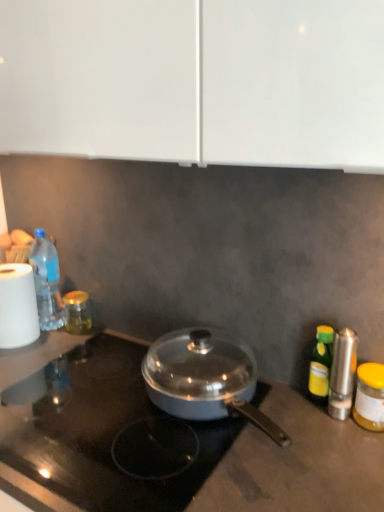
Question: Is green glass bottle at right, which is the 2th bottle in front-to-back order, bigger than white matte paper towel at left?

Choices:
 (A) yes
 (B) no

Answer: (B)

Question: Is green glass bottle at right, the 3th bottle positioned from the back, directly adjacent to white matte paper towel at left?

Choices:
 (A) no
 (B) yes

Answer: (A)

Question: Is green glass bottle at right, the third bottle from the left, positioned before white matte paper towel at left?

Choices:
 (A) no
 (B) yes

Answer: (B)

Question: From the image's perspective, is green glass bottle at right, marked as the second bottle in a right-to-left arrangement, under white matte paper towel at left?

Choices:
 (A) yes
 (B) no

Answer: (A)

Question: Is green glass bottle at right, the 3th bottle positioned from the back, outside white matte paper towel at left?

Choices:
 (A) yes
 (B) no

Answer: (A)

Question: From a real-world perspective, is white matte paper towel at left physically located above or below gold glass jar at left, which ranks as the 3th bottle in right-to-left order?

Choices:
 (A) below
 (B) above

Answer: (B)

Question: From the image's perspective, relative to gold glass jar at left, which ranks as the 3th bottle in right-to-left order, is white matte paper towel at left above or below?

Choices:
 (A) above
 (B) below

Answer: (A)

Question: Is point (14, 329) closer or farther from the camera than point (82, 301)?

Choices:
 (A) farther
 (B) closer

Answer: (B)

Question: Considering the positions of white matte paper towel at left and gold glass jar at left, the 4th bottle from the front, in the image, is white matte paper towel at left taller or shorter than gold glass jar at left, the 4th bottle from the front,?

Choices:
 (A) short
 (B) tall

Answer: (B)

Question: Which is correct: silver metallic salt shaker at right is inside gold glass jar at left, which ranks as the 3th bottle in right-to-left order, or outside of it?

Choices:
 (A) outside
 (B) inside

Answer: (A)

Question: In terms of size, does silver metallic salt shaker at right appear bigger or smaller than gold glass jar at left, which ranks as the second bottle in left-to-right order?

Choices:
 (A) small
 (B) big

Answer: (A)

Question: From the image's perspective, is silver metallic salt shaker at right positioned above or below gold glass jar at left, the 4th bottle from the front?

Choices:
 (A) below
 (B) above

Answer: (A)

Question: In the image, is silver metallic salt shaker at right positioned in front of or behind gold glass jar at left, the 4th bottle from the front?

Choices:
 (A) front
 (B) behind

Answer: (A)

Question: From a real-world perspective, is translucent plastic bottle at left, positioned as the 2th bottle in back-to-front order, above or below gold glass jar at left, the 4th bottle from the front?

Choices:
 (A) below
 (B) above

Answer: (B)

Question: Does point (52, 300) appear closer or farther from the camera than point (66, 328)?

Choices:
 (A) farther
 (B) closer

Answer: (B)